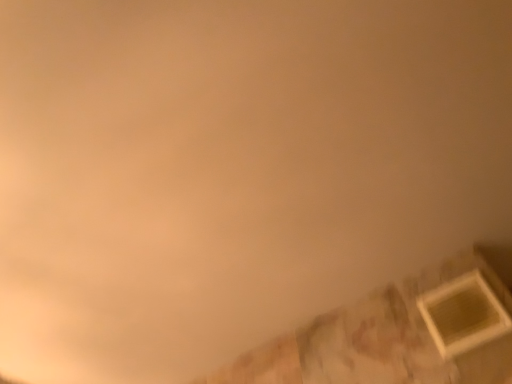
Question: Should I look upward or downward to see wooden frame at lower right?

Choices:
 (A) up
 (B) down

Answer: (B)